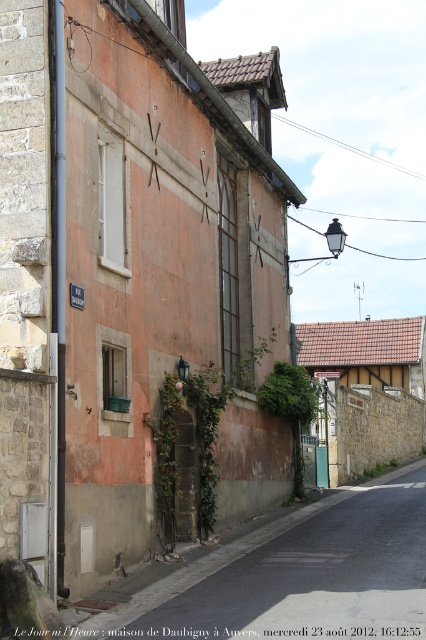
Looking at this image, you are a painter hired to paint the building. You need to determine which object, the green leafy ivy at center or the green plastic sign at center, requires more paint to cover its entire surface area. Which one would need more paint?

The green plastic sign at center requires more paint because its width is greater than the green leafy ivy at center, implying it has a larger surface area to cover.

Consider the image. You are a painter standing at the center of the street. You want to paint the green leafy ivy at center. Where should you position yourself to capture it in your painting?

The green leafy ivy at center is located at coordinates (290,406) in the image, so you should position yourself at the center of the street to capture it effectively.